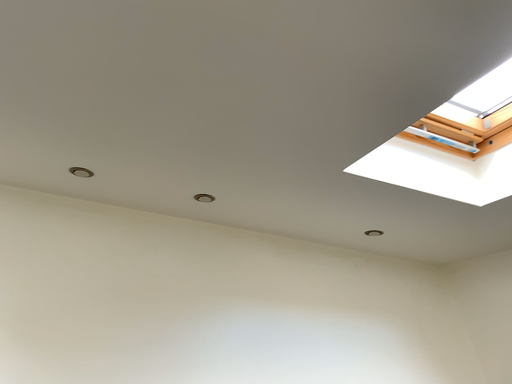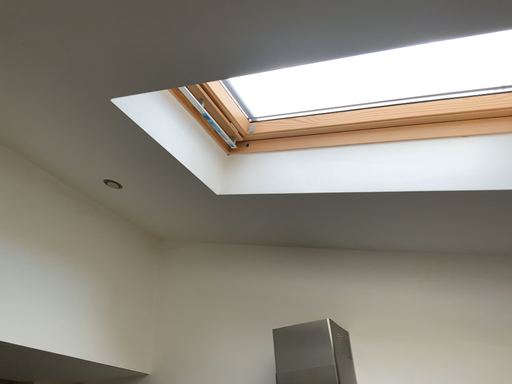
Question: Which way did the camera rotate in the video?

Choices:
 (A) rotated upward
 (B) rotated downward

Answer: (B)